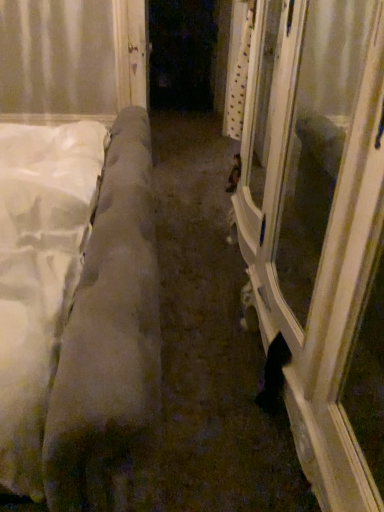
You are a GUI agent. You are given a task and a screenshot of the screen. Output one action in this format:
    pyautogui.click(x=<x>, y=<y>)
    Task: Click on the free point above white glossy door at center (from a real-world perspective)
    
    Given the screenshot: What is the action you would take?
    pyautogui.click(x=208, y=214)